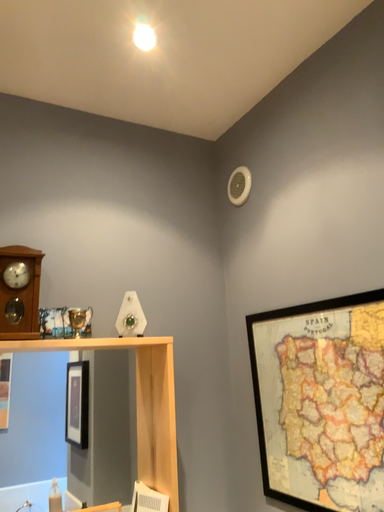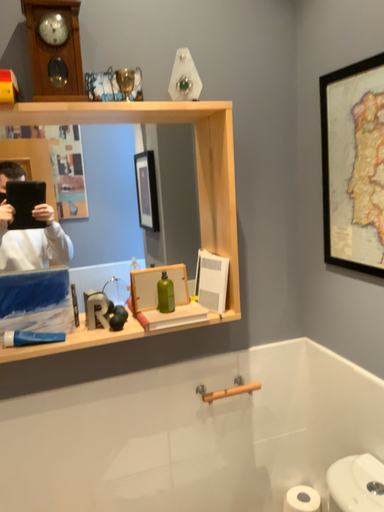
Question: How did the camera likely rotate when shooting the video?

Choices:
 (A) rotated upward
 (B) rotated downward

Answer: (B)